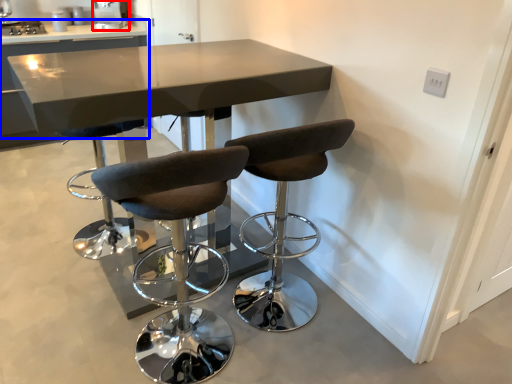
Question: Which of the following is the farthest to the observer, appliance (highlighted by a red box) or table (highlighted by a blue box)?

Choices:
 (A) appliance
 (B) table

Answer: (A)